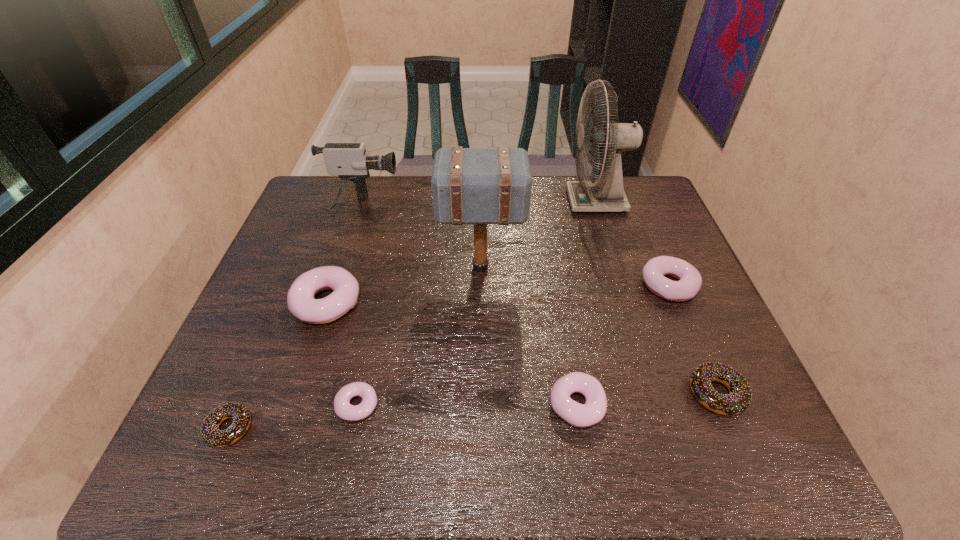
The image size is (960, 540). I want to click on the fourth doughnut from left to right, so click(576, 414).

Where is `the bigger chocolate doughnut`? the bigger chocolate doughnut is located at coordinates (739, 398).

I want to click on the smallest purple doughnut, so click(x=343, y=409).

I want to click on the third purple doughnut from right to left, so click(x=343, y=409).

Find the location of a particular element. The height and width of the screenshot is (540, 960). the smaller chocolate doughnut is located at coordinates [x=210, y=432].

Find the location of a particular element. This screenshot has height=540, width=960. vacant area situated 0.200m on the front-facing side of the fan is located at coordinates (507, 201).

The image size is (960, 540). Identify the location of free space located on the front-facing side of the fan. (452, 201).

The image size is (960, 540). Identify the location of vacant point located 0.270m on the front-facing side of the fan. (486, 201).

Where is `free space located on the striking surface of the fifth object from left to right`? The height and width of the screenshot is (540, 960). free space located on the striking surface of the fifth object from left to right is located at coordinates (301, 267).

The width and height of the screenshot is (960, 540). Find the location of `vacant area located 0.110m on the striking surface of the fifth object from left to right`. vacant area located 0.110m on the striking surface of the fifth object from left to right is located at coordinates (401, 267).